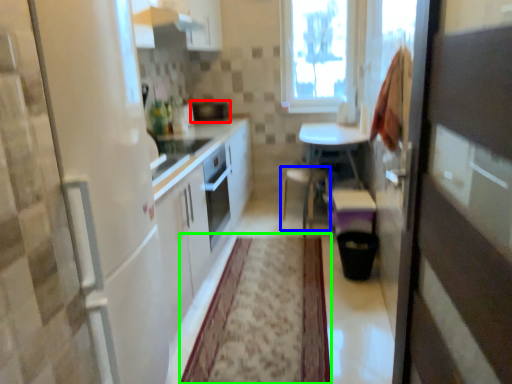
Question: Based on their relative distances, which object is farther from appliance (highlighted by a red box)? Choose from chair (highlighted by a blue box) and plain (highlighted by a green box).

Choices:
 (A) chair
 (B) plain

Answer: (B)